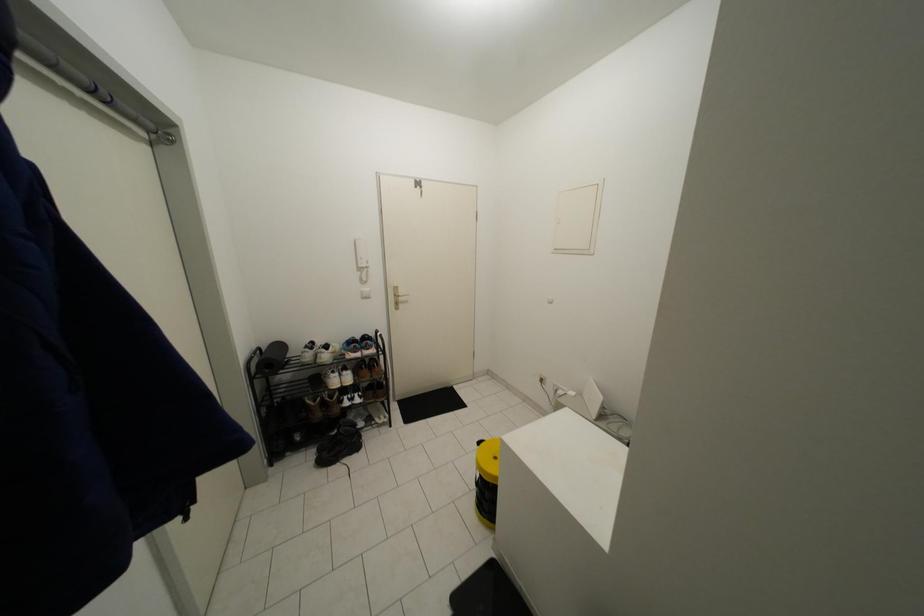
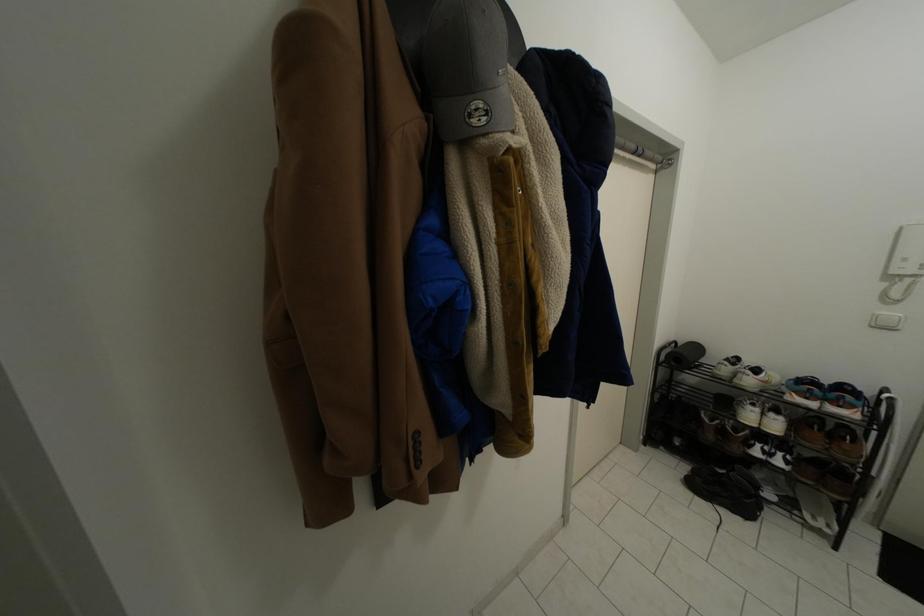
Question: The camera is either moving clockwise (left) or counter-clockwise (right) around the object. The first image is from the beginning of the video and the second image is from the end. Is the camera moving left or right when shooting the video?

Choices:
 (A) Left
 (B) Right

Answer: (B)